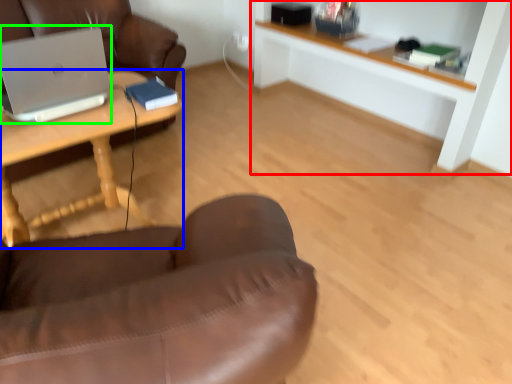
Question: Considering the real-world distances, which object is closest to shelf (highlighted by a red box)? desk (highlighted by a blue box) or laptop (highlighted by a green box).

Choices:
 (A) desk
 (B) laptop

Answer: (A)